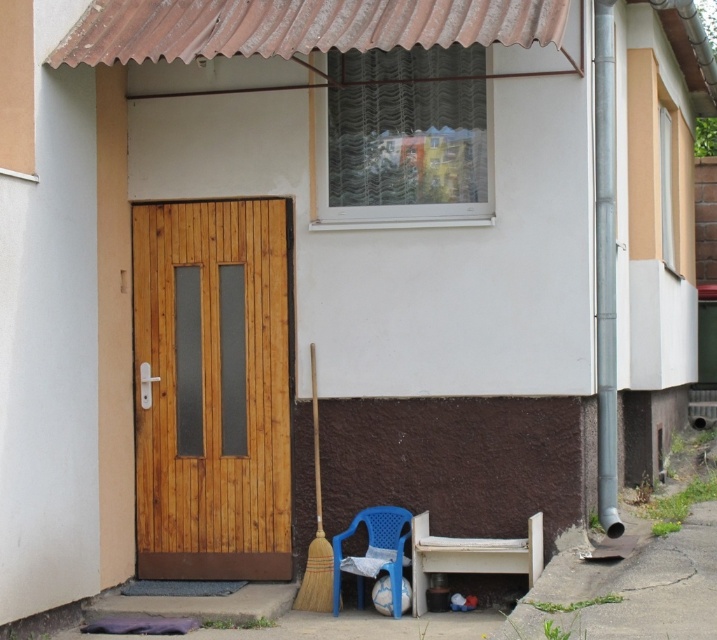
Question: Where is natural wood door at center located in relation to white matte bench at lower right in the image?

Choices:
 (A) right
 (B) left

Answer: (B)

Question: Which is nearer to the white matte bench at lower right?

Choices:
 (A) blue plastic chair at lower center
 (B) natural wood door at center

Answer: (A)

Question: Can you confirm if white matte bench at lower right is thinner than blue plastic chair at lower center?

Choices:
 (A) no
 (B) yes

Answer: (A)

Question: Considering the real-world distances, which object is farthest from the blue plastic chair at lower center?

Choices:
 (A) natural wood door at center
 (B) white matte bench at lower right

Answer: (A)

Question: Based on their relative distances, which object is nearer to the white matte bench at lower right?

Choices:
 (A) natural wood door at center
 (B) blue plastic chair at lower center

Answer: (B)

Question: Does natural wood door at center appear on the right side of white matte bench at lower right?

Choices:
 (A) yes
 (B) no

Answer: (B)